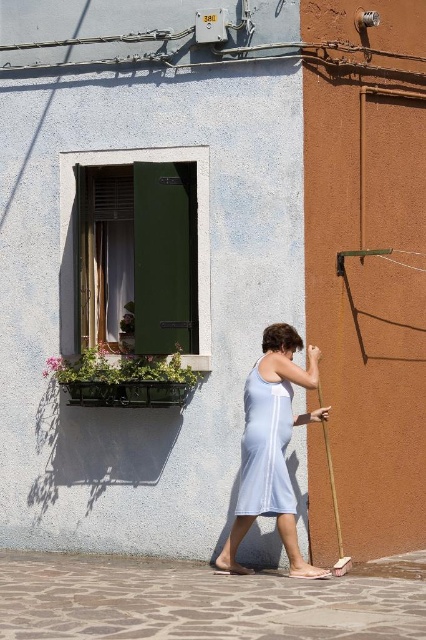
Question: Is white cotton dress at center to the left of light blue fabric dress at center from the viewer's perspective?

Choices:
 (A) no
 (B) yes

Answer: (A)

Question: Where is white cotton dress at center located in relation to green matte door at upper left in the image?

Choices:
 (A) right
 (B) left

Answer: (A)

Question: Is the position of green matte door at upper left more distant than that of light blue fabric dress at center?

Choices:
 (A) no
 (B) yes

Answer: (B)

Question: Which point is closer to the camera?

Choices:
 (A) white cotton dress at center
 (B) green wooden window box at left

Answer: (A)

Question: Considering the real-world distances, which object is farthest from the white cotton dress at center?

Choices:
 (A) green wooden window box at left
 (B) light blue fabric dress at center
 (C) green matte door at upper left

Answer: (C)

Question: Among these objects, which one is farthest from the camera?

Choices:
 (A) white cotton dress at center
 (B) light blue fabric dress at center
 (C) green wooden window box at left

Answer: (C)